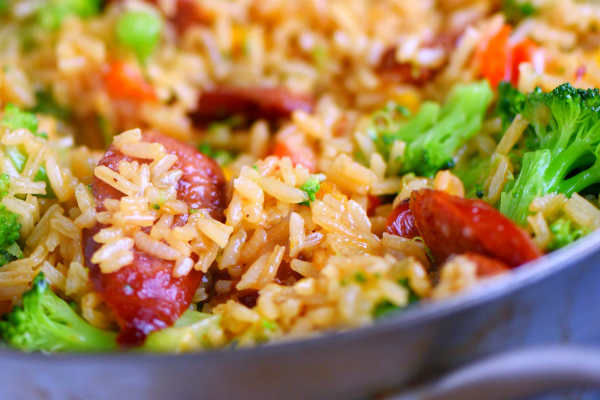
Identify the location of bowl rim. coord(572,250).